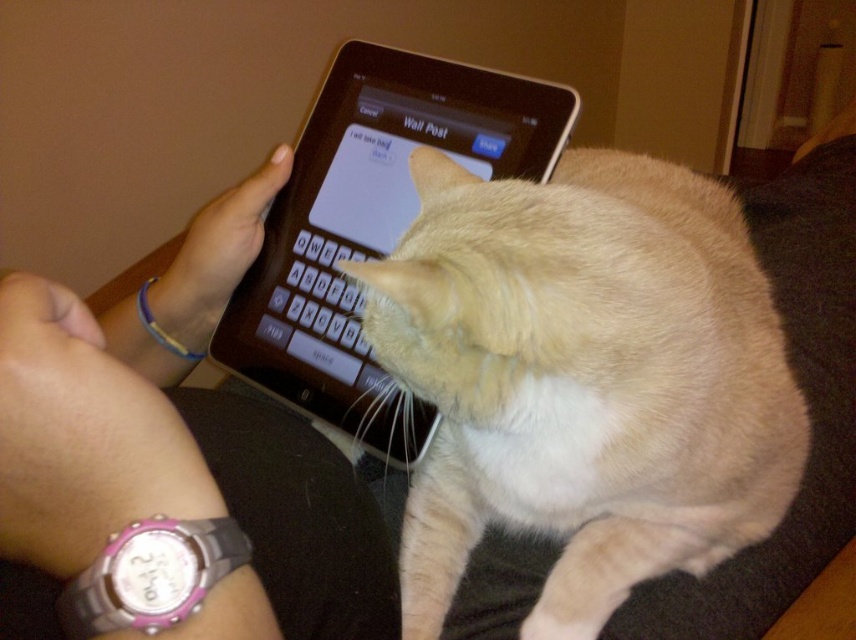
Is black glossy tablet at center shorter than pink plastic watch at lower left?

No.

Can you confirm if black glossy tablet at center is wider than pink plastic watch at lower left?

Yes, black glossy tablet at center is wider than pink plastic watch at lower left.

Measure the distance between point (355, 90) and camera.

A distance of 26.96 inches exists between point (355, 90) and camera.

This screenshot has height=640, width=856. Find the location of `black glossy tablet at center`. black glossy tablet at center is located at coordinates (370, 225).

Who is positioned more to the left, light brown fur cat at center or pink plastic watch at lower left?

Positioned to the left is pink plastic watch at lower left.

Between light brown fur cat at center and pink plastic watch at lower left, which one is positioned higher?

light brown fur cat at center is above.

Does point (721, 365) come behind point (223, 572)?

Yes.

This screenshot has width=856, height=640. I want to click on light brown fur cat at center, so click(583, 380).

Does pink rubber watch at upper left lie in front of pink plastic watch at lower left?

Yes, it is in front of pink plastic watch at lower left.

Between point (70, 381) and point (182, 554), which one is positioned behind?

The point (70, 381) is behind.

Locate an element on the screen. pink rubber watch at upper left is located at coordinates (171, 474).